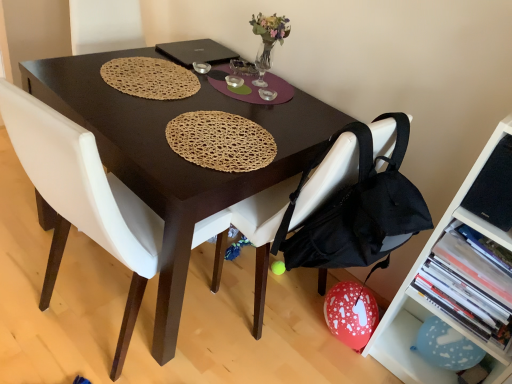
Question: Is black fabric chair at lower right, which is the 1th chair in right-to-left order, positioned far away from white leather chair at center, which is the 2th chair in right-to-left order?

Choices:
 (A) no
 (B) yes

Answer: (A)

Question: From a real-world perspective, does black fabric chair at lower right, the 2th chair in the left-to-right sequence, sit lower than white leather chair at center, the first chair viewed from the left?

Choices:
 (A) yes
 (B) no

Answer: (B)

Question: From a real-world perspective, is black fabric chair at lower right, which is the 1th chair in right-to-left order, positioned over white leather chair at center, which is the 2th chair in right-to-left order, based on gravity?

Choices:
 (A) yes
 (B) no

Answer: (A)

Question: Is white leather chair at center, the first chair viewed from the left, a part of black fabric chair at lower right, the 2th chair in the left-to-right sequence?

Choices:
 (A) no
 (B) yes

Answer: (A)

Question: Is black fabric chair at lower right, which is the 1th chair in right-to-left order, at the left side of white leather chair at center, which is the 2th chair in right-to-left order?

Choices:
 (A) no
 (B) yes

Answer: (A)

Question: Is black fabric chair at lower right, the 2th chair in the left-to-right sequence, further to the viewer compared to white leather chair at center, the first chair viewed from the left?

Choices:
 (A) yes
 (B) no

Answer: (A)

Question: Considering the relative sizes of hardcover book at lower right and metallic silver bowl at center in the image provided, is hardcover book at lower right thinner than metallic silver bowl at center?

Choices:
 (A) yes
 (B) no

Answer: (B)

Question: From the image's perspective, would you say hardcover book at lower right is positioned over metallic silver bowl at center?

Choices:
 (A) yes
 (B) no

Answer: (B)

Question: Does hardcover book at lower right have a larger size compared to metallic silver bowl at center?

Choices:
 (A) no
 (B) yes

Answer: (B)

Question: Is hardcover book at lower right positioned far away from metallic silver bowl at center?

Choices:
 (A) yes
 (B) no

Answer: (A)

Question: From the image's perspective, is hardcover book at lower right located beneath metallic silver bowl at center?

Choices:
 (A) no
 (B) yes

Answer: (B)

Question: Can you confirm if hardcover book at lower right is shorter than metallic silver bowl at center?

Choices:
 (A) yes
 (B) no

Answer: (B)

Question: Is blue paper balloon at lower right, marked as the second shelf in a top-to-bottom arrangement, a part of translucent glass vase at upper center?

Choices:
 (A) yes
 (B) no

Answer: (B)